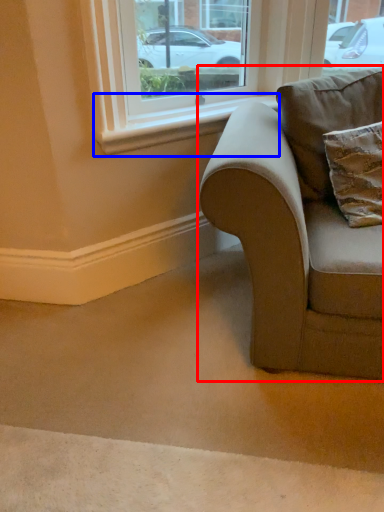
Question: Among these objects, which one is farthest to the camera, studio couch (highlighted by a red box) or window sill (highlighted by a blue box)?

Choices:
 (A) studio couch
 (B) window sill

Answer: (B)